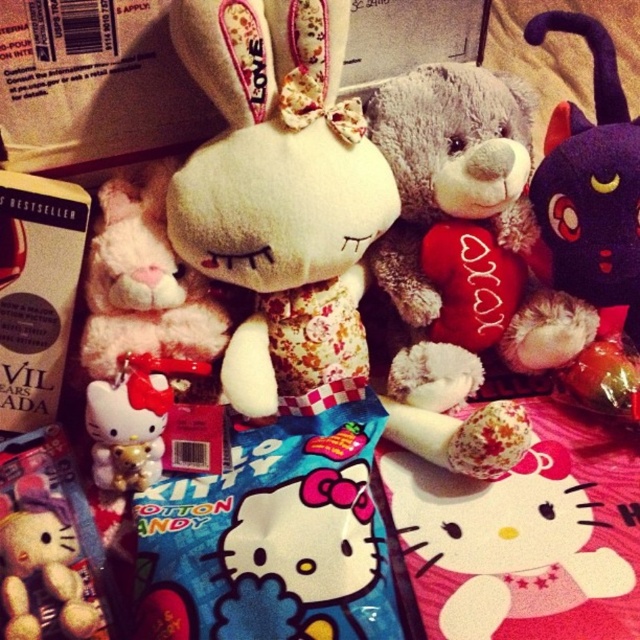
Question: Is fluffy plush hello kitty at center to the right of white plush hello kitty at center from the viewer's perspective?

Choices:
 (A) yes
 (B) no

Answer: (A)

Question: Where is fluffy white teddy bear at center located in relation to matte cardboard book at center in the image?

Choices:
 (A) above
 (B) below

Answer: (A)

Question: Which point appears farthest from the camera in this image?

Choices:
 (A) (6, 326)
 (B) (168, 404)
 (C) (184, 180)
 (D) (289, 582)

Answer: (B)

Question: Which point is closer to the camera?

Choices:
 (A) fluffy plush hello kitty at center
 (B) matte cardboard book at center
 (C) fluffy white teddy bear at center
 (D) fluffy plush toy at center

Answer: (A)

Question: Which point is closer to the camera?

Choices:
 (A) matte cardboard book at center
 (B) fluffy white teddy bear at center
 (C) fluffy plush hello kitty at center

Answer: (C)

Question: Is fluffy gray teddy bear at center bigger than white plush hello kitty at center?

Choices:
 (A) yes
 (B) no

Answer: (A)